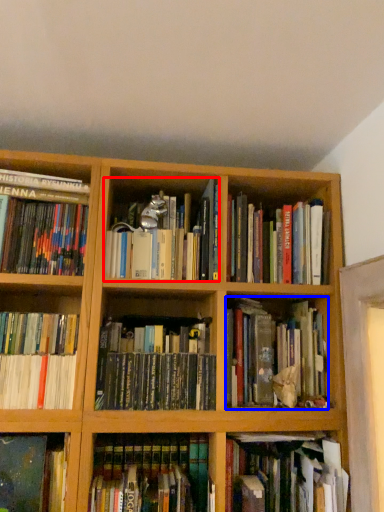
Question: Which of the following is the farthest to the observer, book (highlighted by a red box) or book (highlighted by a blue box)?

Choices:
 (A) book
 (B) book

Answer: (B)